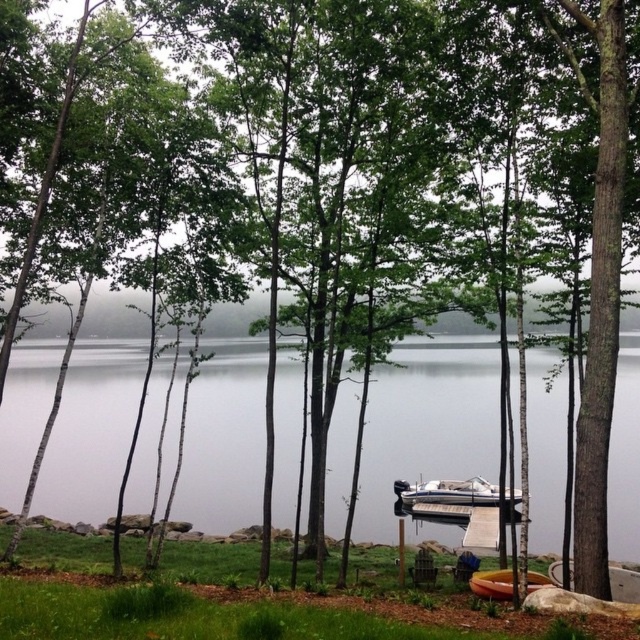
Question: Which object is closer to the camera taking this photo?

Choices:
 (A) yellow plastic canoe at lower center
 (B) clear water at center

Answer: (A)

Question: Considering the real-world distances, which object is farthest from the white glossy boat at center?

Choices:
 (A) yellow plastic canoe at lower center
 (B) clear water at center

Answer: (A)

Question: Does clear water at center appear under white glossy boat at center?

Choices:
 (A) no
 (B) yes

Answer: (A)

Question: Can you confirm if white glossy boat at center is wider than yellow plastic canoe at lower center?

Choices:
 (A) no
 (B) yes

Answer: (B)

Question: Which point appears farthest from the camera in this image?

Choices:
 (A) (636, 380)
 (B) (496, 596)
 (C) (449, 481)

Answer: (A)

Question: Observing the image, what is the correct spatial positioning of clear water at center in reference to white glossy boat at center?

Choices:
 (A) above
 (B) below

Answer: (A)